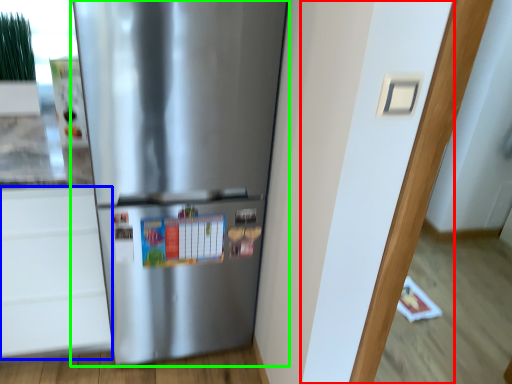
Question: Estimate the real-world distances between objects in this image. Which object is closer to door (highlighted by a red box), drawer (highlighted by a blue box) or refrigerator (highlighted by a green box)?

Choices:
 (A) drawer
 (B) refrigerator

Answer: (B)